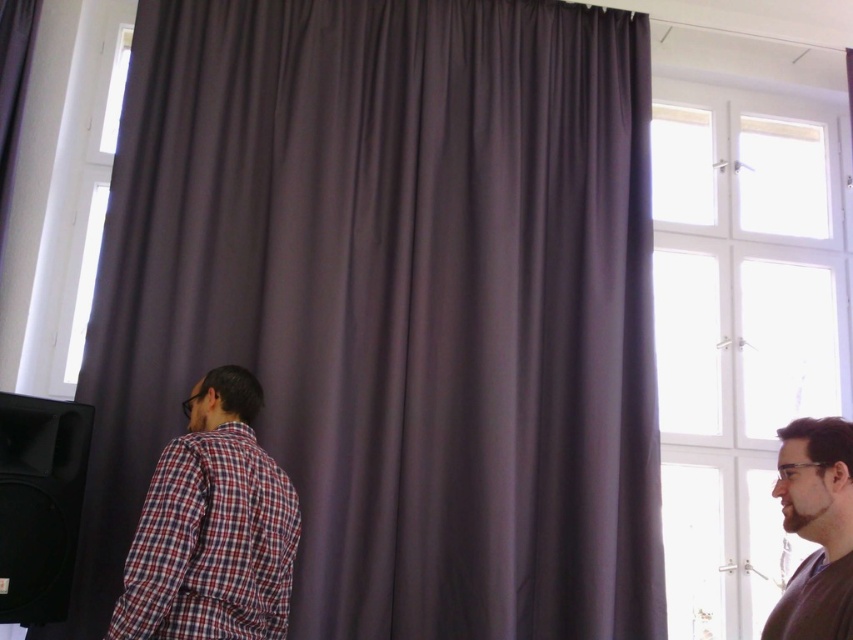
In the scene shown: You are organizing a charity event and need to decide which of the two shirts, the plaid fabric shirt at left or the brown matte shirt at right, can accommodate a larger embroidered logo. Based on the image, which shirt would you choose?

The plaid fabric shirt at left is bigger than the brown matte shirt at right, so it can accommodate a larger embroidered logo.

You are an event organizer setting up a presentation. You have a purple matte curtain at center and a plaid fabric shirt at left. Which object is wider?

The purple matte curtain at center is wider than the plaid fabric shirt at left.